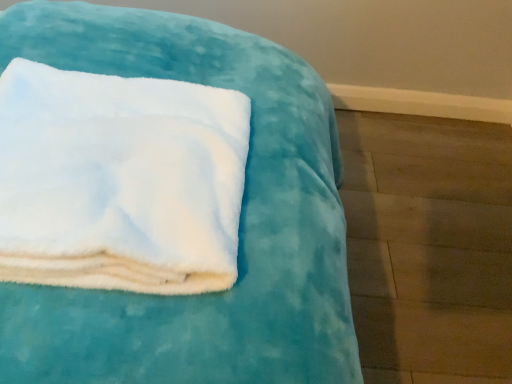
Question: Considering the positions of point (130, 195) and point (295, 326), is point (130, 195) closer or farther from the camera than point (295, 326)?

Choices:
 (A) closer
 (B) farther

Answer: (B)

Question: Is white fluffy towel at upper left inside or outside of white fluffy towel at upper left?

Choices:
 (A) inside
 (B) outside

Answer: (B)

Question: From the image's perspective, is white fluffy towel at upper left above or below white fluffy towel at upper left?

Choices:
 (A) below
 (B) above

Answer: (B)

Question: Considering the positions of point click(x=55, y=370) and point click(x=227, y=225), is point click(x=55, y=370) closer or farther from the camera than point click(x=227, y=225)?

Choices:
 (A) closer
 (B) farther

Answer: (A)

Question: Looking at their shapes, would you say white fluffy towel at upper left is wider or thinner than white fluffy towel at upper left?

Choices:
 (A) thin
 (B) wide

Answer: (B)

Question: In terms of height, does white fluffy towel at upper left look taller or shorter compared to white fluffy towel at upper left?

Choices:
 (A) short
 (B) tall

Answer: (A)

Question: From the image's perspective, is white fluffy towel at upper left above or below white fluffy towel at upper left?

Choices:
 (A) below
 (B) above

Answer: (A)